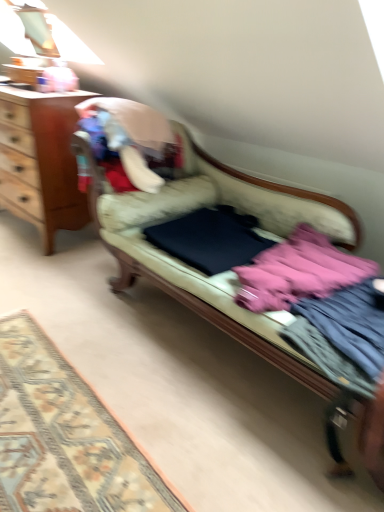
Question: Is velvet beige couch at center positioned behind wooden desk at left?

Choices:
 (A) no
 (B) yes

Answer: (A)

Question: Would you say velvet beige couch at center is a long distance from wooden desk at left?

Choices:
 (A) yes
 (B) no

Answer: (B)

Question: Is velvet beige couch at center taller than wooden desk at left?

Choices:
 (A) yes
 (B) no

Answer: (B)

Question: Is velvet beige couch at center at the right side of wooden desk at left?

Choices:
 (A) no
 (B) yes

Answer: (B)

Question: Considering the relative sizes of velvet beige couch at center and wooden desk at left in the image provided, is velvet beige couch at center thinner than wooden desk at left?

Choices:
 (A) no
 (B) yes

Answer: (A)

Question: Considering the positions of pink fabric at center and carpeted rug at lower left in the image, is pink fabric at center bigger or smaller than carpeted rug at lower left?

Choices:
 (A) big
 (B) small

Answer: (A)

Question: In the image, is pink fabric at center positioned in front of or behind carpeted rug at lower left?

Choices:
 (A) front
 (B) behind

Answer: (B)

Question: From a real-world perspective, is pink fabric at center physically located above or below carpeted rug at lower left?

Choices:
 (A) below
 (B) above

Answer: (B)

Question: Is pink fabric at center taller or shorter than carpeted rug at lower left?

Choices:
 (A) tall
 (B) short

Answer: (A)

Question: Is point (41, 489) closer or farther from the camera than point (342, 350)?

Choices:
 (A) farther
 (B) closer

Answer: (A)

Question: Looking at the image, does carpeted rug at lower left seem bigger or smaller compared to pink fabric at right, acting as the 2th clothing starting from the back?

Choices:
 (A) big
 (B) small

Answer: (A)

Question: Is carpeted rug at lower left spatially inside pink fabric at right, positioned as the first clothing in front-to-back order, or outside of it?

Choices:
 (A) outside
 (B) inside

Answer: (A)

Question: From the image's perspective, is carpeted rug at lower left positioned above or below pink fabric at right, acting as the 2th clothing starting from the back?

Choices:
 (A) above
 (B) below

Answer: (B)

Question: Is pink fabric at right, positioned as the first clothing in front-to-back order, bigger or smaller than wooden desk at left?

Choices:
 (A) big
 (B) small

Answer: (B)

Question: Is point (327, 335) positioned closer to the camera than point (64, 168)?

Choices:
 (A) closer
 (B) farther

Answer: (A)